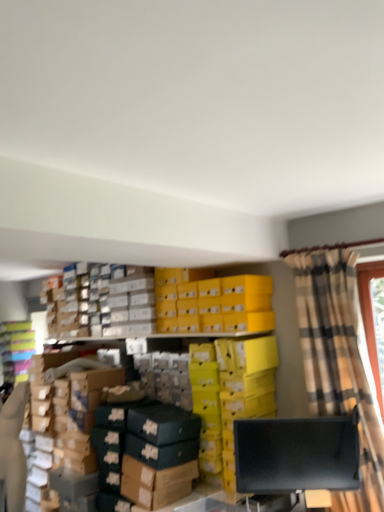
Question: Considering their positions, is black matte monitor at lower right located in front of or behind matte plastic shoebox at left?

Choices:
 (A) behind
 (B) front

Answer: (B)

Question: Is black matte monitor at lower right taller or shorter than matte plastic shoebox at left?

Choices:
 (A) tall
 (B) short

Answer: (B)

Question: Which of these objects is positioned farthest from the black matte monitor at lower right?

Choices:
 (A) matte plastic shoebox at left
 (B) plaid fabric curtain at right

Answer: (A)

Question: Which object is positioned farthest from the plaid fabric curtain at right?

Choices:
 (A) black matte monitor at lower right
 (B) matte plastic shoebox at left

Answer: (B)